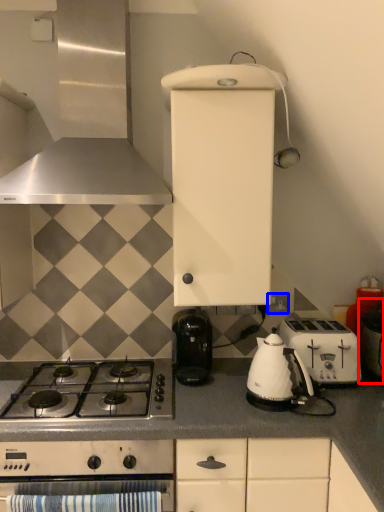
Question: Which object is further to the camera taking this photo, appliance (highlighted by a red box) or electric outlet (highlighted by a blue box)?

Choices:
 (A) appliance
 (B) electric outlet

Answer: (B)